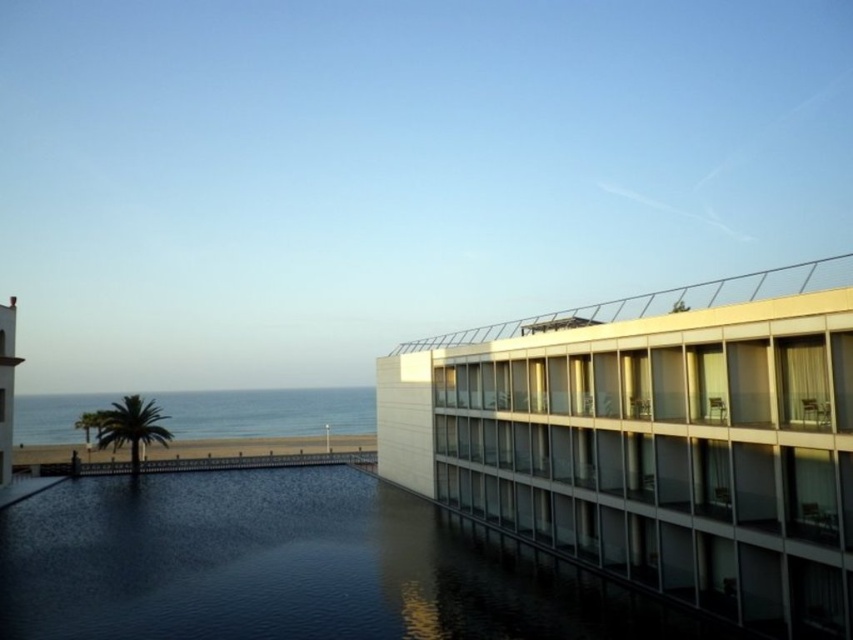
Can you confirm if white glass balcony at upper right is shorter than smooth white tower at left?

Correct, white glass balcony at upper right is not as tall as smooth white tower at left.

Between white glass balcony at upper right and smooth white tower at left, which one is positioned lower?

smooth white tower at left

Identify the location of white glass balcony at upper right. The height and width of the screenshot is (640, 853). (660, 301).

Where is `white glass balcony at upper right`? The height and width of the screenshot is (640, 853). white glass balcony at upper right is located at coordinates (660, 301).

Image resolution: width=853 pixels, height=640 pixels. Describe the element at coordinates (654, 440) in the screenshot. I see `white glass building at right` at that location.

Which is below, white glass building at right or smooth white tower at left?

white glass building at right is below.

This screenshot has width=853, height=640. Find the location of `white glass building at right`. white glass building at right is located at coordinates (654, 440).

At what (x,y) coordinates should I click in order to perform the action: click on white glass building at right. Please return your answer as a coordinate pair (x, y). Looking at the image, I should click on (654, 440).

Consider the image. How distant is white glass building at right from white glass balcony at upper right?

They are 3.07 meters apart.

Locate an element on the screen. Image resolution: width=853 pixels, height=640 pixels. white glass building at right is located at coordinates (654, 440).

Identify the location of white glass building at right. (654, 440).